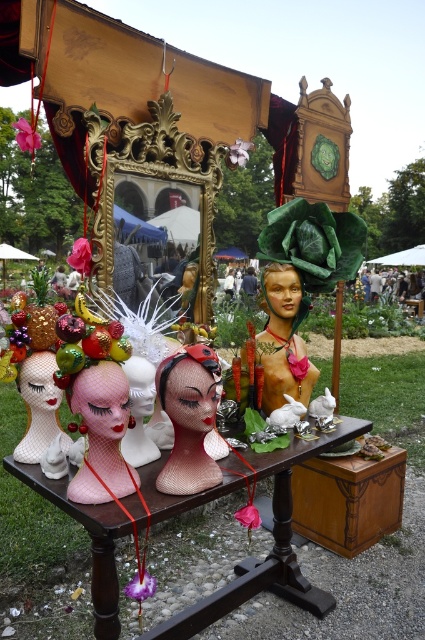
Question: Can you confirm if wooden table at center is thinner than matte plastic doll at center?

Choices:
 (A) no
 (B) yes

Answer: (A)

Question: Which of the following is the farthest from the observer?

Choices:
 (A) (68, 486)
 (B) (175, 426)
 (C) (282, 276)
 (D) (158, 634)

Answer: (C)

Question: Can you confirm if pink mesh head at center is positioned to the left of matte plastic doll at center?

Choices:
 (A) yes
 (B) no

Answer: (A)

Question: Based on their relative distances, which object is nearer to the pink mesh head at center?

Choices:
 (A) satin pink wig at center
 (B) wooden table at center

Answer: (A)

Question: Which point is closer to the camera?

Choices:
 (A) wooden table at center
 (B) matte plastic doll at center
 (C) pink mesh head at center

Answer: (A)

Question: Is wooden table at center to the left of satin pink wig at center from the viewer's perspective?

Choices:
 (A) no
 (B) yes

Answer: (A)